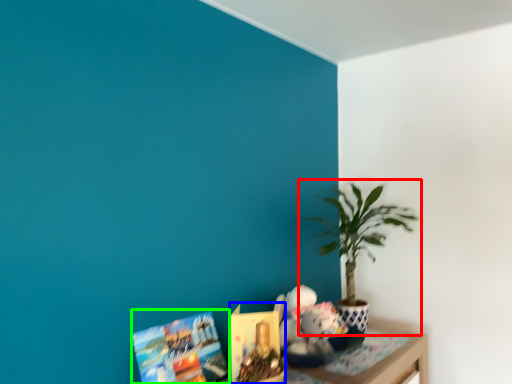
Question: Considering the real-world distances, which object is farthest from houseplant (highlighted by a red box)? book (highlighted by a blue box) or book (highlighted by a green box)?

Choices:
 (A) book
 (B) book

Answer: (B)